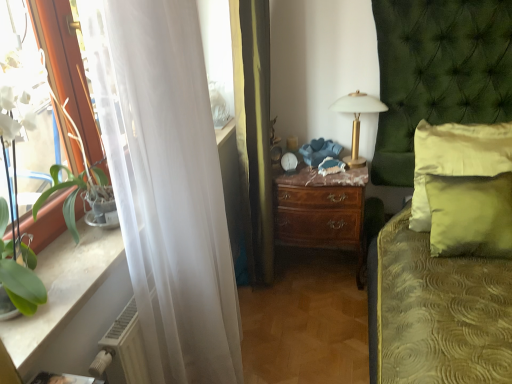
Question: Should I look upward or downward to see white plastic radiator at lower left?

Choices:
 (A) down
 (B) up

Answer: (A)

Question: Is green textured bed at center taller than gold metallic table lamp at upper center?

Choices:
 (A) yes
 (B) no

Answer: (A)

Question: Considering the relative sizes of green textured bed at center and gold metallic table lamp at upper center in the image provided, is green textured bed at center smaller than gold metallic table lamp at upper center?

Choices:
 (A) yes
 (B) no

Answer: (B)

Question: Would you say green textured bed at center contains gold metallic table lamp at upper center?

Choices:
 (A) yes
 (B) no

Answer: (A)

Question: Can you confirm if green textured bed at center is bigger than gold metallic table lamp at upper center?

Choices:
 (A) yes
 (B) no

Answer: (A)

Question: Is the depth of green textured bed at center greater than that of gold metallic table lamp at upper center?

Choices:
 (A) yes
 (B) no

Answer: (B)

Question: Is green textured bed at center not close to gold metallic table lamp at upper center?

Choices:
 (A) yes
 (B) no

Answer: (B)

Question: Is brown wood nightstand at center outside of white plastic radiator at lower left?

Choices:
 (A) no
 (B) yes

Answer: (B)

Question: Does brown wood nightstand at center have a smaller size compared to white plastic radiator at lower left?

Choices:
 (A) no
 (B) yes

Answer: (A)

Question: Could you tell me if brown wood nightstand at center is turned towards white plastic radiator at lower left?

Choices:
 (A) yes
 (B) no

Answer: (A)

Question: Is brown wood nightstand at center to the left of white plastic radiator at lower left from the viewer's perspective?

Choices:
 (A) no
 (B) yes

Answer: (A)

Question: Is brown wood nightstand at center far away from white plastic radiator at lower left?

Choices:
 (A) yes
 (B) no

Answer: (A)

Question: Is white plastic radiator at lower left completely or partially inside brown wood nightstand at center?

Choices:
 (A) yes
 (B) no

Answer: (B)

Question: From a real-world perspective, is green satin pillow at right, the first pillow positioned from the back, located higher than brown wood nightstand at center?

Choices:
 (A) yes
 (B) no

Answer: (A)